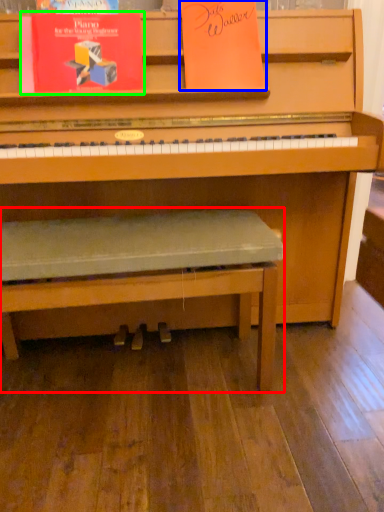
Question: Which object is positioned farthest from church bench (highlighted by a red box)? Select from paperback book (highlighted by a blue box) and paperback book (highlighted by a green box).

Choices:
 (A) paperback book
 (B) paperback book

Answer: (A)